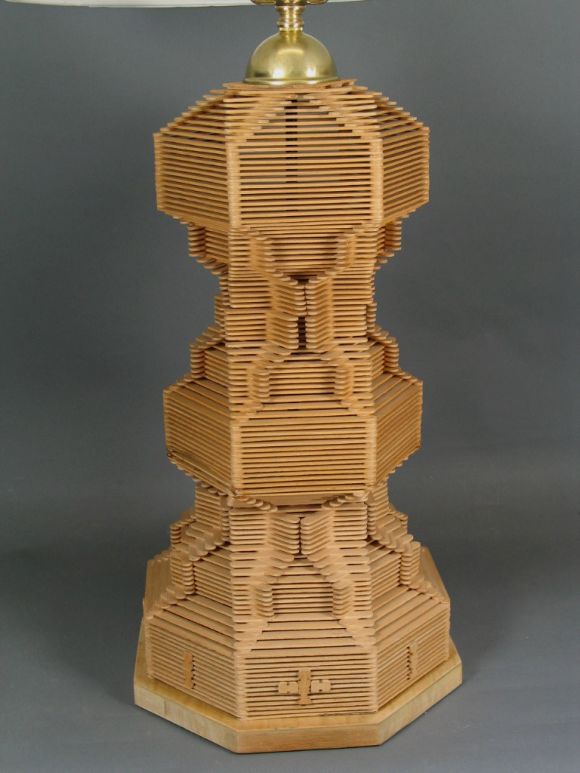
Where is `table`? The width and height of the screenshot is (580, 773). table is located at coordinates (307, 734).